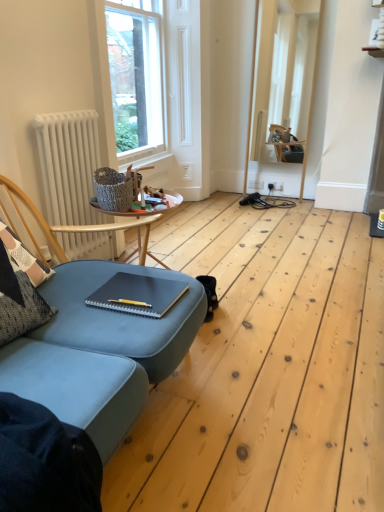
Question: From their relative heights in the image, would you say clear glass window at upper center is taller or shorter than matte black notebook at center?

Choices:
 (A) tall
 (B) short

Answer: (A)

Question: Considering their positions, is clear glass window at upper center located in front of or behind matte black notebook at center?

Choices:
 (A) front
 (B) behind

Answer: (B)

Question: Which object is positioned farthest from the matte black notebook at center?

Choices:
 (A) white matte radiator at left
 (B) clear glass window at upper center
 (C) white wooden frame at upper center

Answer: (C)

Question: Considering the real-world distances, which object is closest to the white wooden frame at upper center?

Choices:
 (A) white matte radiator at left
 (B) clear glass window at upper center
 (C) matte black notebook at center

Answer: (B)